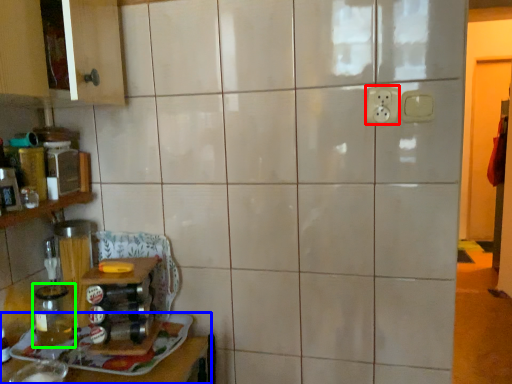
Question: Considering the real-world distances, which object is farthest from electric outlet (highlighted by a red box)? furniture (highlighted by a blue box) or glass jar (highlighted by a green box)?

Choices:
 (A) furniture
 (B) glass jar

Answer: (B)